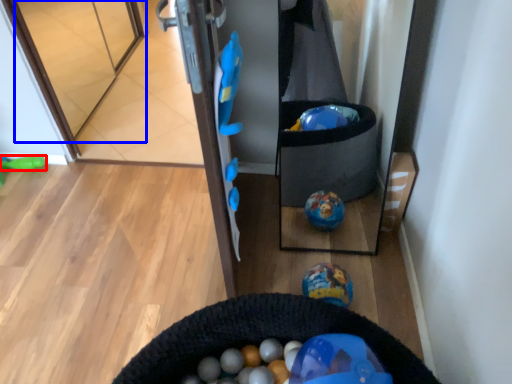
Question: Among these objects, which one is farthest to the camera, toy (highlighted by a red box) or glass door (highlighted by a blue box)?

Choices:
 (A) toy
 (B) glass door

Answer: (A)